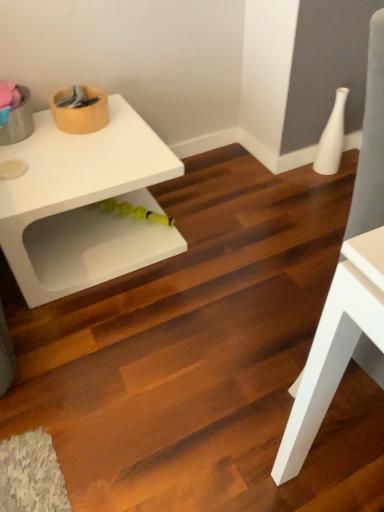
This screenshot has height=512, width=384. In order to click on vacant area on top of white matte table at upper left, the second table when ordered from front to back (from a real-world perspective) in this screenshot , I will do `click(64, 152)`.